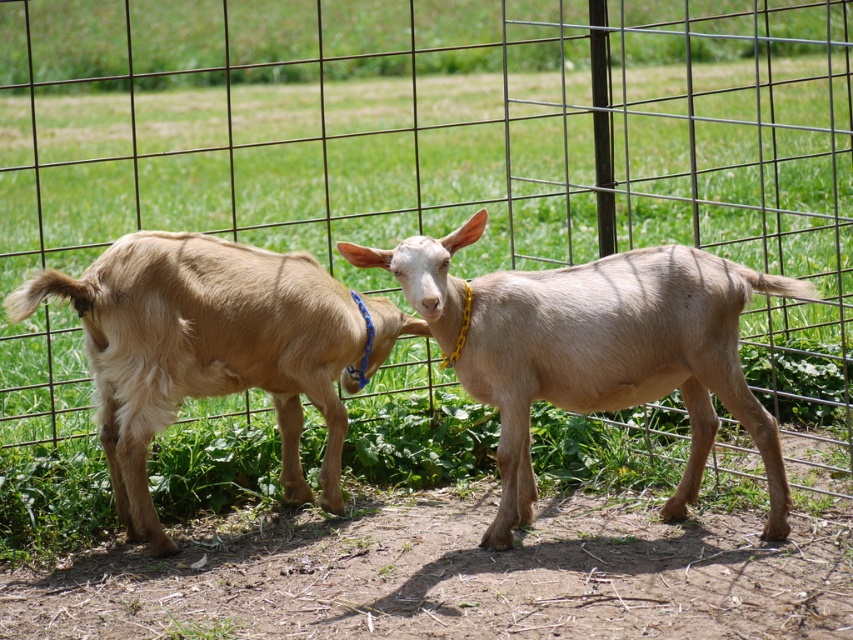
Who is lower down, light brown fur goat at center or light brown fur goat at left?

light brown fur goat at left

Is point (492, 385) closer to viewer compared to point (254, 273)?

Yes.

Which is behind, point (519, 483) or point (125, 324)?

The point (519, 483) is behind.

What are the coordinates of `light brown fur goat at center` in the screenshot? It's located at (593, 348).